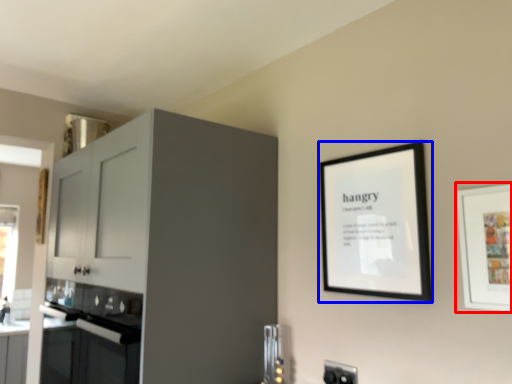
Question: Which object appears closest to the camera in this image, picture frame (highlighted by a red box) or picture frame (highlighted by a blue box)?

Choices:
 (A) picture frame
 (B) picture frame

Answer: (A)